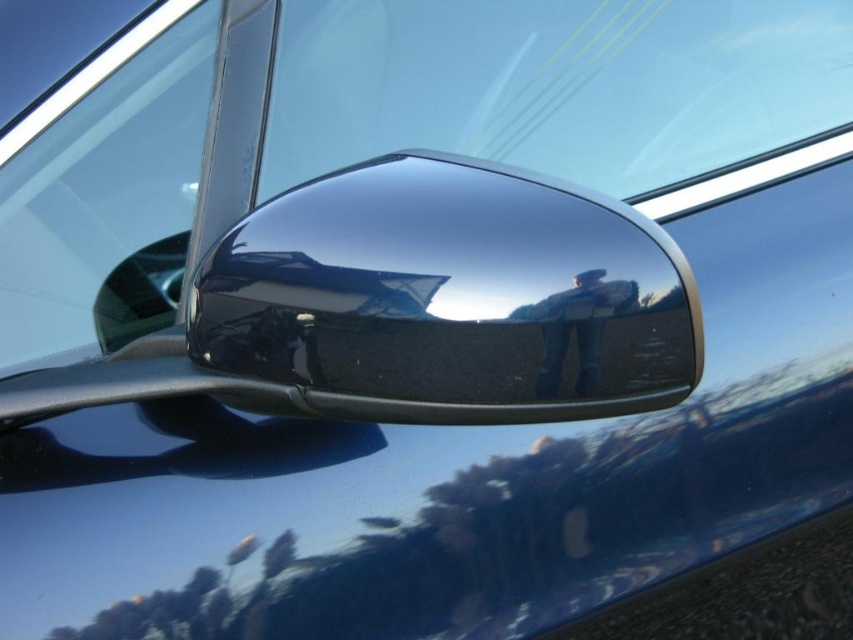
You are a car designer evaluating the aesthetics of two glossy chrome mirrors on a car. The car has a glossy chrome mirror at center and a glossy chrome side mirror at lower left. Which mirror has a greater width?

The glossy chrome mirror at center has a greater width than the glossy chrome side mirror at lower left.

You are a passenger in the car and want to look at the view outside through the glossy chrome mirror at center and the transparent glass car window at upper left. Which object allows you to see the outside more clearly?

The transparent glass car window at upper left allows you to see the outside more clearly because it is a window designed for viewing, whereas the glossy chrome mirror at center is a reflective surface primarily for checking blind spots.

You are a passenger in the car and want to see the road behind you. Which object would you look through to check the rearview? The glossy chrome mirror at center or the transparent glass car window at upper left?

You should look through the glossy chrome mirror at center to check the rearview because it is designed to reflect the road behind the car, whereas the transparent glass car window at upper left is positioned at an angle that does not provide a rearview perspective.